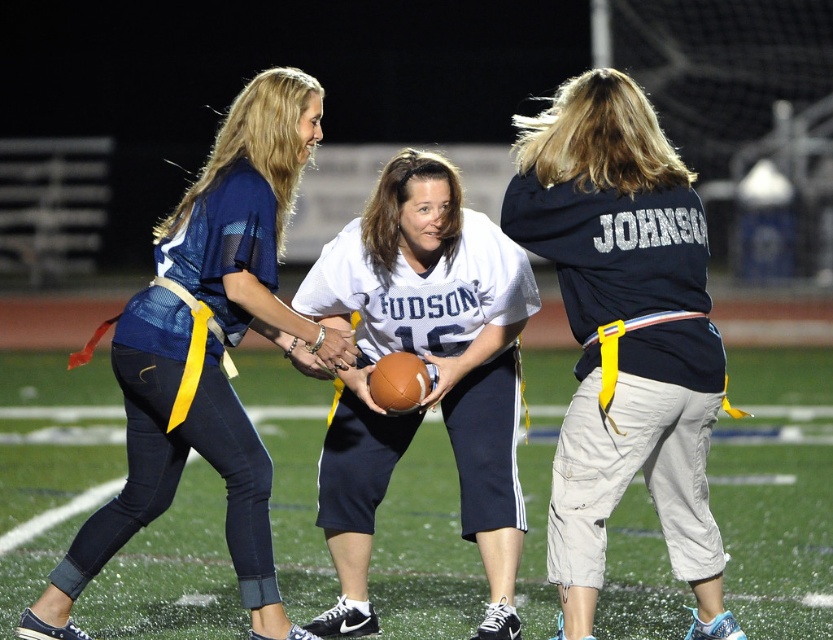
You are a referee observing the flag football game. You notice two players wearing the navy blue jersey at center and the white jersey at center. Which player is taller?

The navy blue jersey at center is taller than the white jersey at center.

In the scene shown: You are a spectator at the football game and want to take a photo of both the matte blue jersey at center and the white jersey at center. Which jersey should you point your camera towards first to capture them both in the frame?

The matte blue jersey at center is to the left of the white jersey at center, so you should aim your camera towards the left side first to include both in the frame.